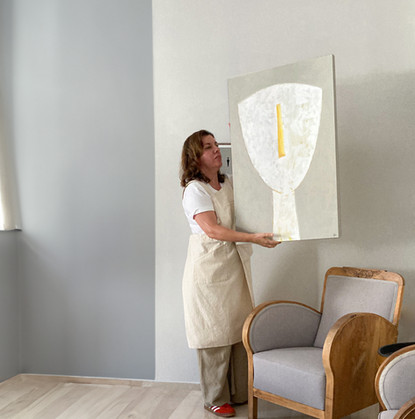
I want to click on chair, so click(337, 365), click(398, 399).